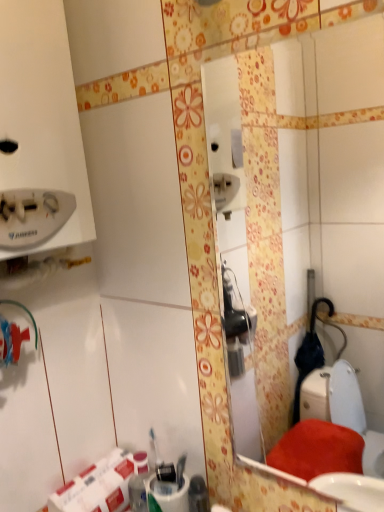
Question: Can you confirm if white glossy mirror at center is bigger than white matte toilet paper at lower left?

Choices:
 (A) yes
 (B) no

Answer: (B)

Question: Is white glossy mirror at center shorter than white matte toilet paper at lower left?

Choices:
 (A) no
 (B) yes

Answer: (A)

Question: Is white glossy mirror at center smaller than white matte toilet paper at lower left?

Choices:
 (A) yes
 (B) no

Answer: (A)

Question: Is white glossy mirror at center looking in the opposite direction of white matte toilet paper at lower left?

Choices:
 (A) no
 (B) yes

Answer: (A)

Question: Is white glossy mirror at center far from white matte toilet paper at lower left?

Choices:
 (A) no
 (B) yes

Answer: (B)

Question: Can you confirm if white glossy mirror at center is taller than white matte toilet paper at lower left?

Choices:
 (A) no
 (B) yes

Answer: (B)

Question: Is the depth of white matte toilet paper at lower left less than that of white glossy mirror at center?

Choices:
 (A) yes
 (B) no

Answer: (B)

Question: Does white matte toilet paper at lower left have a greater height compared to white glossy mirror at center?

Choices:
 (A) no
 (B) yes

Answer: (A)

Question: From a real-world perspective, does white matte toilet paper at lower left stand above white glossy mirror at center?

Choices:
 (A) yes
 (B) no

Answer: (B)

Question: Would you say white matte toilet paper at lower left is outside white glossy mirror at center?

Choices:
 (A) yes
 (B) no

Answer: (A)

Question: From the image's perspective, is white matte toilet paper at lower left under white glossy mirror at center?

Choices:
 (A) yes
 (B) no

Answer: (A)

Question: Is white matte toilet paper at lower left shorter than white glossy mirror at center?

Choices:
 (A) yes
 (B) no

Answer: (A)

Question: Choose the correct answer: Is white matte toilet paper at lower left inside white glossy mirror at center or outside it?

Choices:
 (A) outside
 (B) inside

Answer: (A)